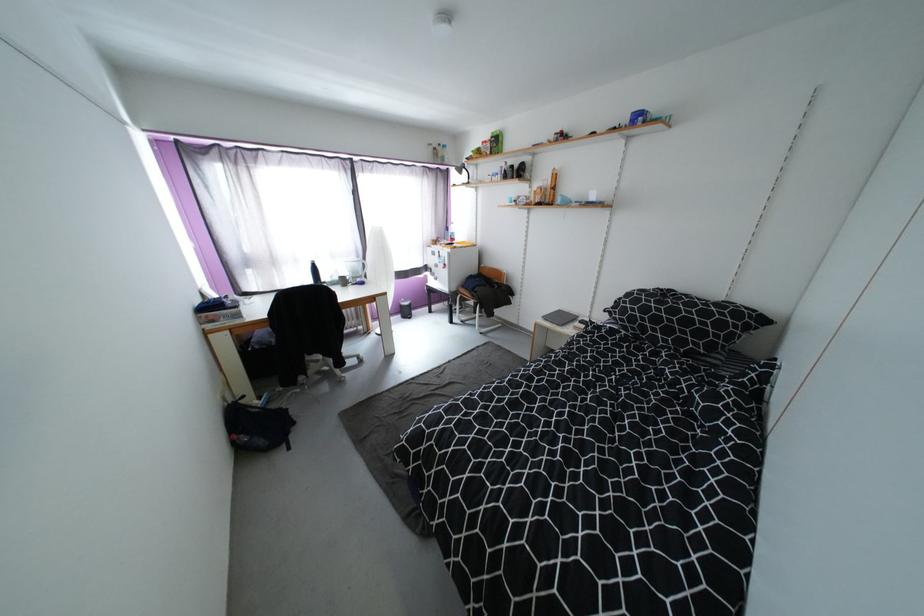
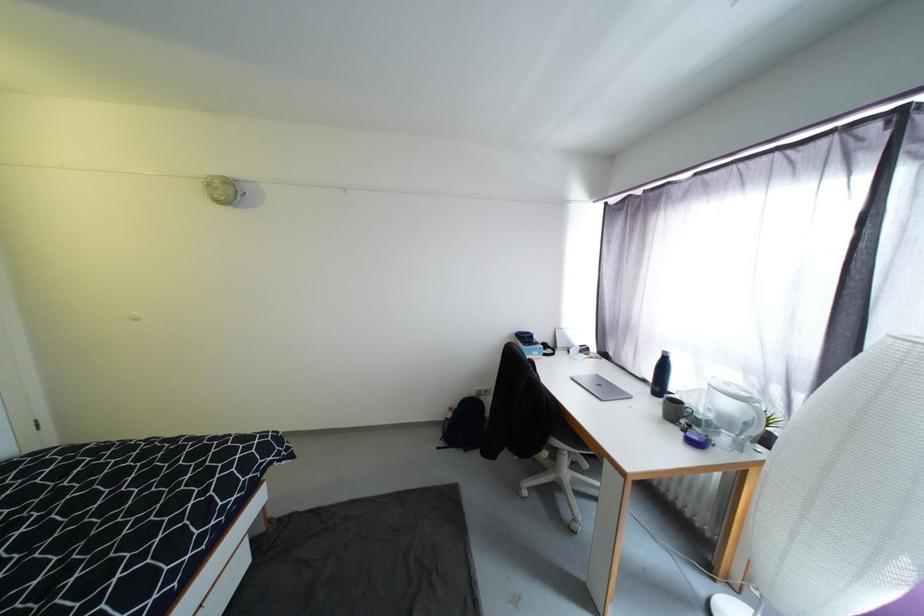
Where in the second image is the point corresponding to (349,283) from the first image?

(683, 413)